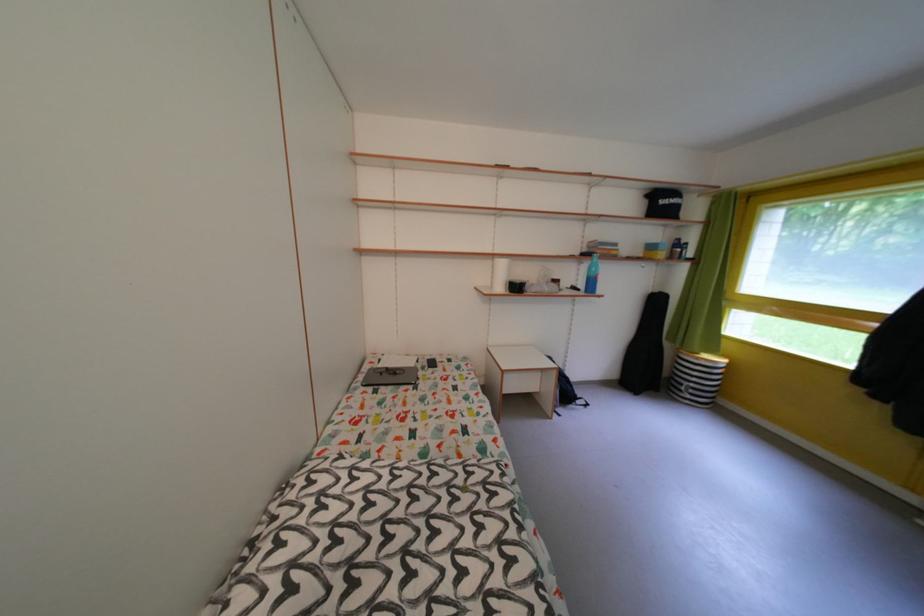
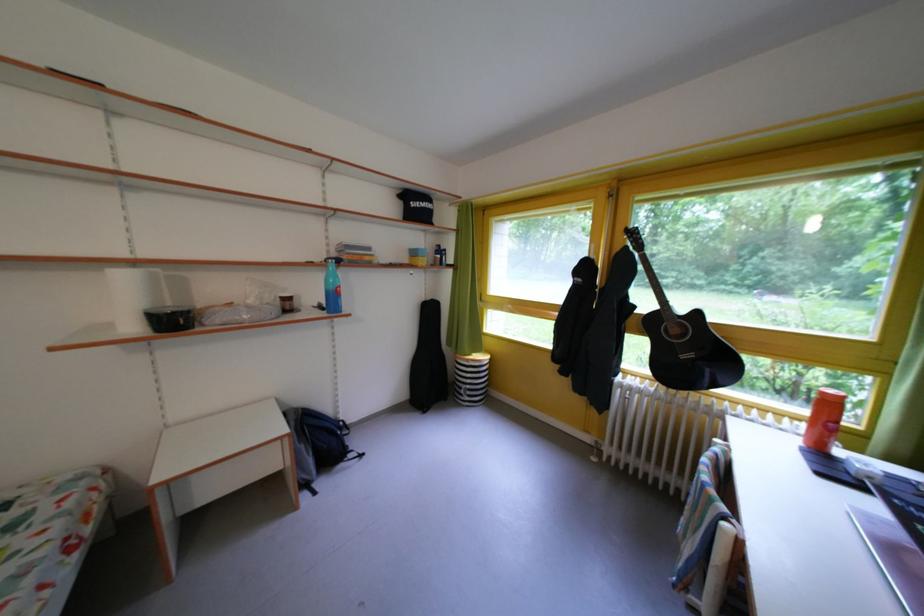
In the second image, find the point that corresponds to [526,294] in the first image.

(184, 328)